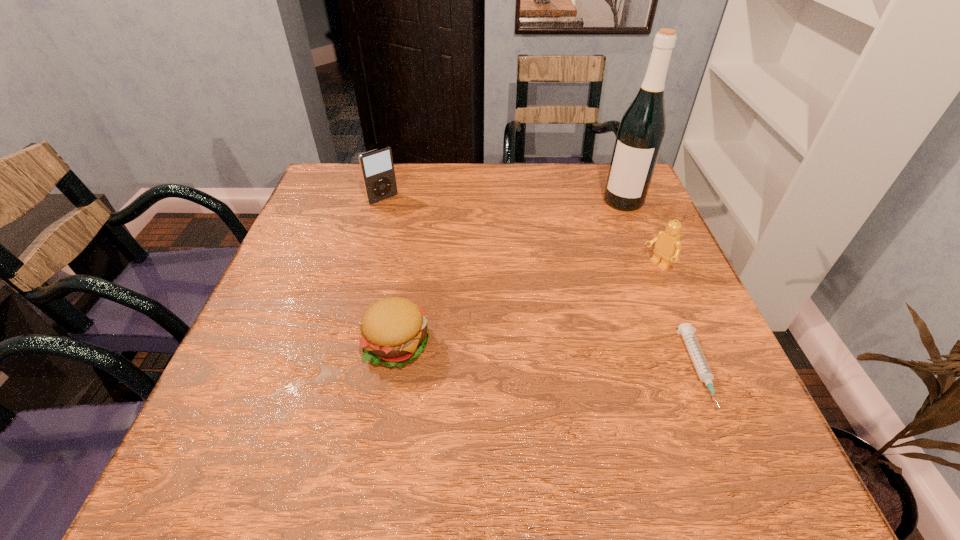
Locate an element on the screen. free space located 0.150m on the face of the Lego is located at coordinates (602, 301).

The image size is (960, 540). What are the coordinates of `vacant space located 0.320m on the face of the Lego` in the screenshot? It's located at (542, 339).

Locate an element on the screen. Image resolution: width=960 pixels, height=540 pixels. vacant space located 0.200m on the face of the Lego is located at coordinates (586, 312).

At what (x,y) coordinates should I click in order to perform the action: click on free location located on the label of the tallest object. Please return your answer as a coordinate pair (x, y). This screenshot has height=540, width=960. Looking at the image, I should click on (562, 311).

Locate an element on the screen. This screenshot has width=960, height=540. vacant region located 0.080m on the label of the tallest object is located at coordinates (609, 227).

Identify the location of vacant space located on the label of the tallest object. point(597,248).

Locate an element on the screen. This screenshot has height=540, width=960. iPod at the far edge is located at coordinates (377, 168).

Locate an element on the screen. The image size is (960, 540). wine bottle at the far edge is located at coordinates (640, 135).

At what (x,y) coordinates should I click in order to perform the action: click on object at the near edge. Please return your answer as a coordinate pair (x, y). Looking at the image, I should click on (686, 330).

Locate an element on the screen. object present at the left edge is located at coordinates (377, 168).